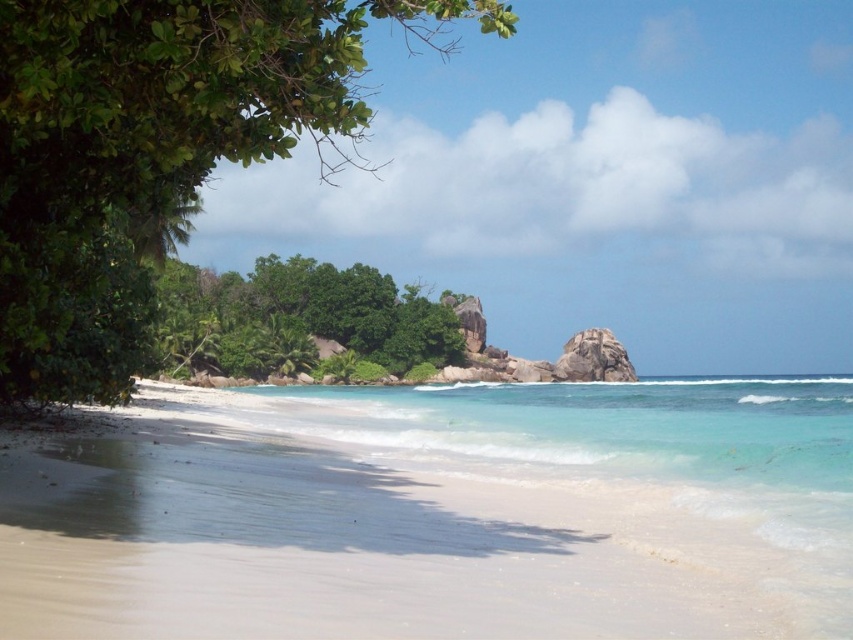
Who is taller, clear blue water at center or smooth granite rock at center?

Standing taller between the two is smooth granite rock at center.

Does clear blue water at center have a lesser height compared to smooth granite rock at center?

Correct, clear blue water at center is not as tall as smooth granite rock at center.

Identify the location of clear blue water at center. The image size is (853, 640). (605, 429).

In the scene shown: Which of these two, clear blue water at center or green leafy tree at center, stands shorter?

Standing shorter between the two is clear blue water at center.

Which is below, clear blue water at center or green leafy tree at center?

clear blue water at center

Between point (665, 436) and point (370, 268), which one is positioned in front?

Point (665, 436)

The width and height of the screenshot is (853, 640). What are the coordinates of `clear blue water at center` in the screenshot? It's located at [605, 429].

Can you confirm if white sand beach at lower left is positioned to the right of green leafy tree at upper left?

Correct, you'll find white sand beach at lower left to the right of green leafy tree at upper left.

Does white sand beach at lower left have a lesser height compared to green leafy tree at upper left?

Yes.

Between point (59, 611) and point (39, 268), which one is positioned in front?

Point (59, 611) is in front.

Locate an element on the screen. white sand beach at lower left is located at coordinates (444, 515).